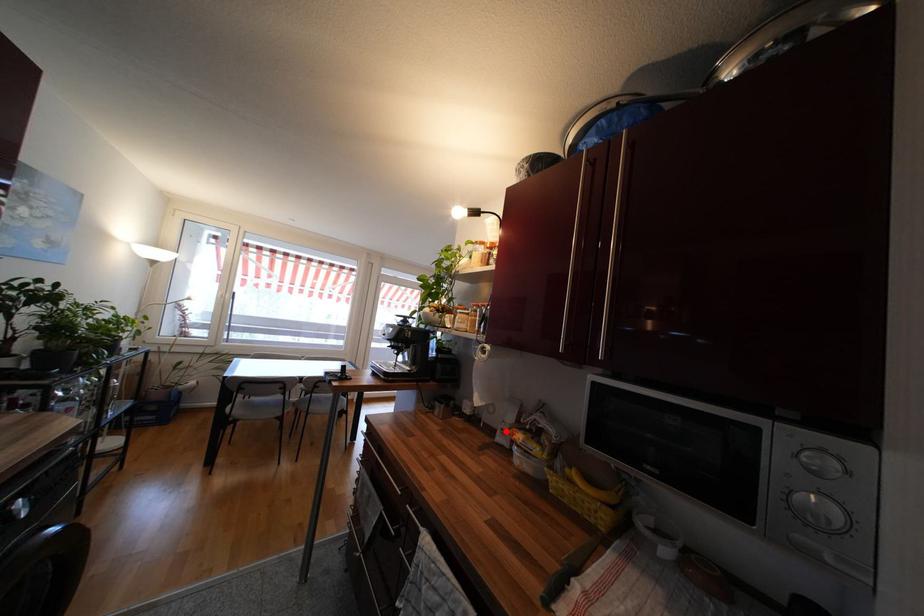
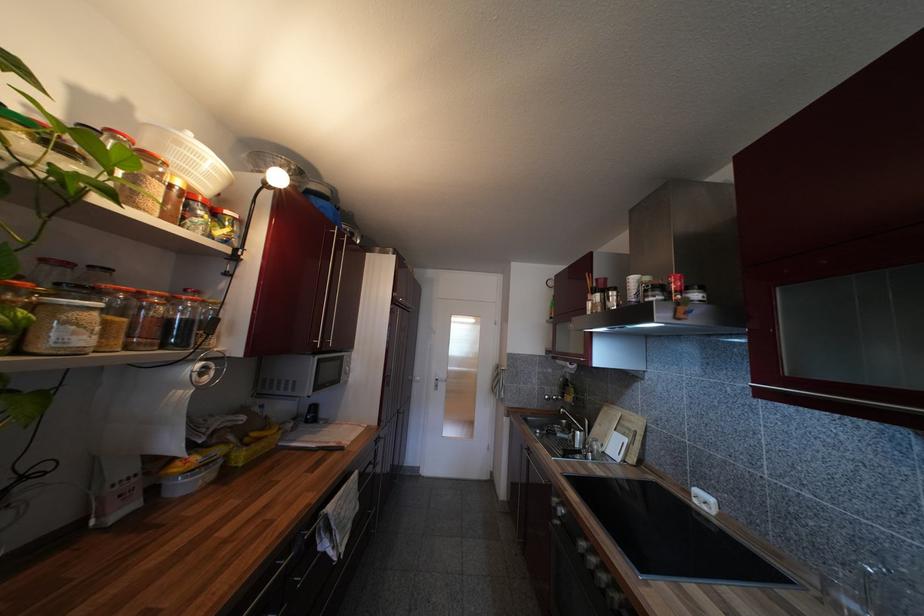
Locate, in the second image, the point that corresponds to the highlighted location in the first image.

(124, 498)